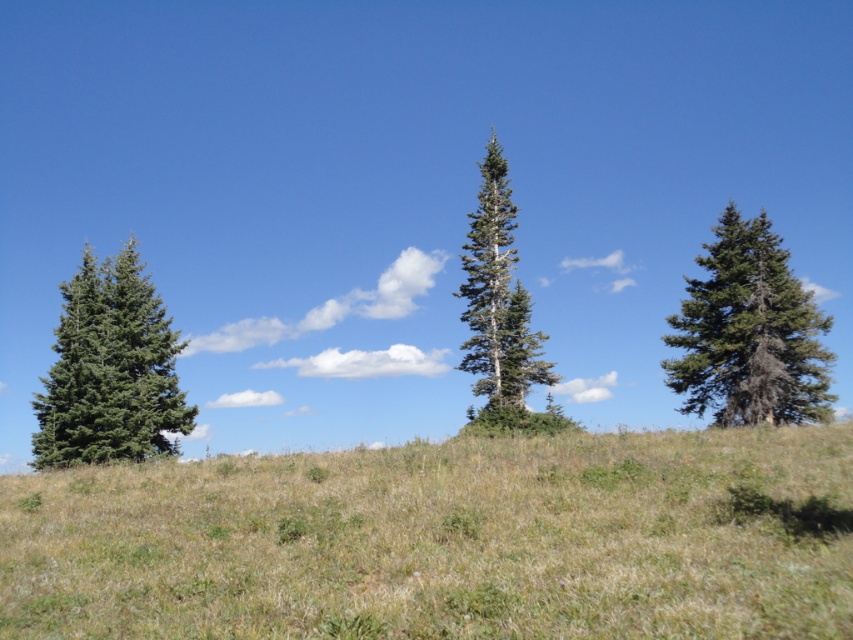
You are a hiker who wants to take a photo of the green grassy hillside at center and the green matte tree at right. Which object should you focus on first if you want to capture both in a single frame without moving the camera?

The green grassy hillside at center is shorter than the green matte tree at right, so you should focus on the green grassy hillside at center first to ensure it is in the foreground and properly framed before the taller tree comes into view.

You are a bird looking for a nesting spot. You see the green matte tree at right and the green matte tree at center. Which tree would you choose if you prefer nesting behind another tree for shelter?

The green matte tree at center is behind the green matte tree at right, so choosing the green matte tree at center would place your nest behind the green matte tree at right for shelter.